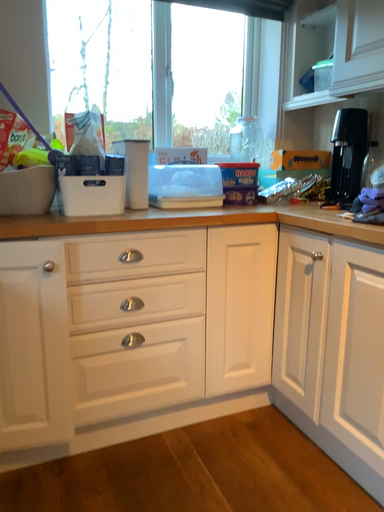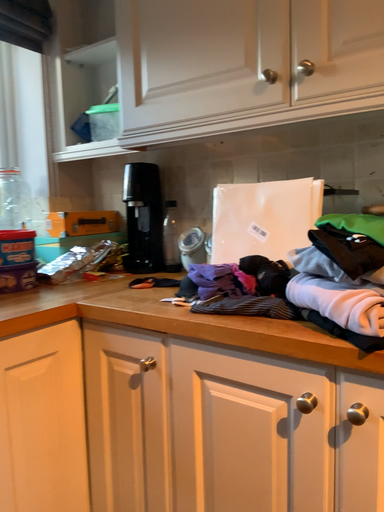
Question: Which way did the camera rotate in the video?

Choices:
 (A) rotated upward
 (B) rotated downward

Answer: (A)